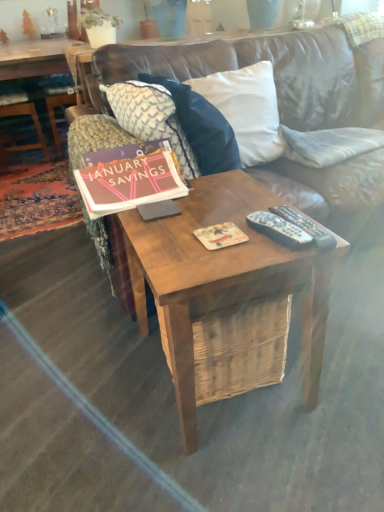
Find the location of a particular element. The image size is (384, 512). free spot in front of matte cardboard magazine at center is located at coordinates (224, 262).